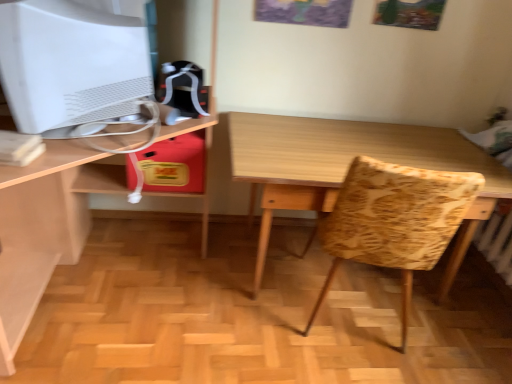
You are a GUI agent. You are given a task and a screenshot of the screen. Output one action in this format:
    pyautogui.click(x=<x>, y=<y>)
    Task: Click on the vacant location below wooden table at center (from a real-world perspective)
    This screenshot has width=512, height=384.
    Given the screenshot: What is the action you would take?
    pyautogui.click(x=315, y=263)